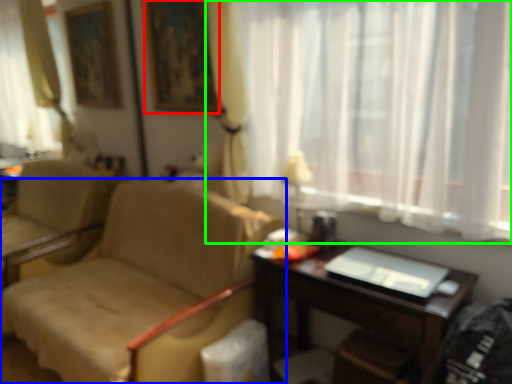
Question: Considering the real-world distances, which object is farthest from picture frame (highlighted by a red box)? chair (highlighted by a blue box) or curtain (highlighted by a green box)?

Choices:
 (A) chair
 (B) curtain

Answer: (A)